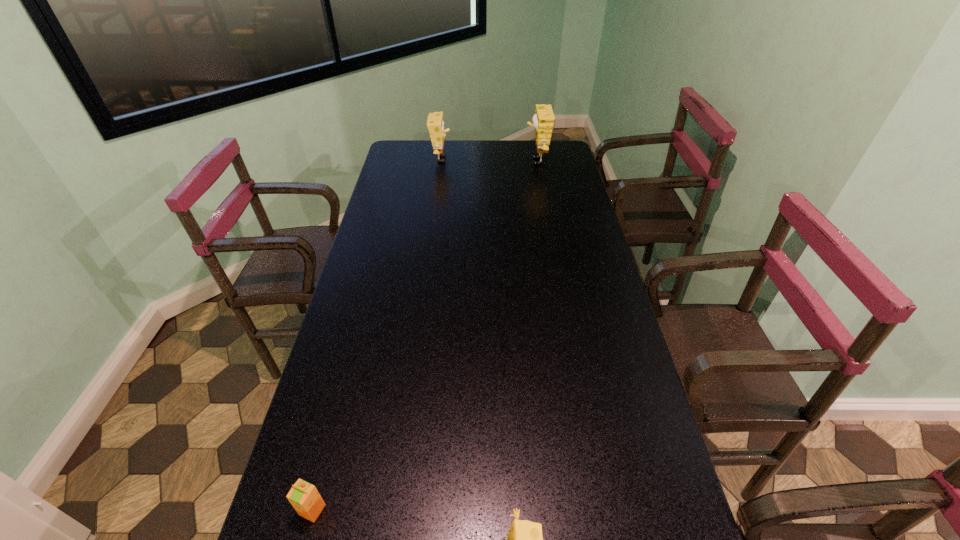
This screenshot has height=540, width=960. I want to click on the tallest object, so click(543, 120).

You are a GUI agent. You are given a task and a screenshot of the screen. Output one action in this format:
    pyautogui.click(x=<x>, y=<y>)
    Task: Click on the tallest sponge
    Image resolution: width=960 pixels, height=540 pixels.
    Given the screenshot: What is the action you would take?
    pyautogui.click(x=543, y=120)

Locate an element on the screen. Image resolution: width=960 pixels, height=540 pixels. the second shortest sponge is located at coordinates (435, 123).

Image resolution: width=960 pixels, height=540 pixels. In order to click on the leftmost sponge in this screenshot , I will do `click(435, 123)`.

Locate an element on the screen. This screenshot has width=960, height=540. orange juice is located at coordinates (304, 497).

Image resolution: width=960 pixels, height=540 pixels. I want to click on the third farthest object, so click(x=304, y=497).

Locate an element on the screen. This screenshot has height=540, width=960. vacant space situated 0.150m on the front-facing side of the rightmost object is located at coordinates (492, 161).

You are a GUI agent. You are given a task and a screenshot of the screen. Output one action in this format:
    pyautogui.click(x=<x>, y=<y>)
    Task: Click on the vacant space located 0.370m on the front-facing side of the rightmost object
    Image resolution: width=960 pixels, height=540 pixels.
    Given the screenshot: What is the action you would take?
    pyautogui.click(x=443, y=161)

Find the location of `vacant point located on the front-facing side of the rightmost object`. vacant point located on the front-facing side of the rightmost object is located at coordinates (463, 161).

I want to click on vacant region located on the face of the second tallest object, so click(x=504, y=159).